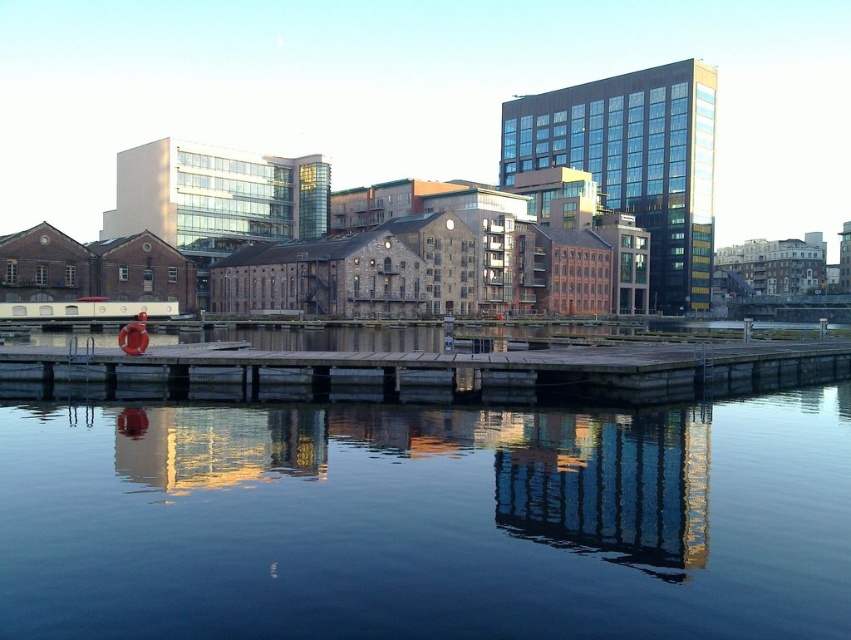
You are standing at the waterfront and want to take a photo that includes both the old industrial buildings and the modern high rises. Which point, point [244,516] or point [437,355], should you focus on to ensure both structures are in clear view?

Point [244,516] is closer to the camera than point [437,355], so focusing on this point will help ensure both the old industrial buildings and modern high rises are in clear view.

You are standing on the wooden pier and want to place a floating dock in the water. According to the scene, which object is taller, the dark blue water at center or the wooden at center?

The dark blue water at center is taller than the wooden at center, so the floating dock should be placed in the dark blue water at center.